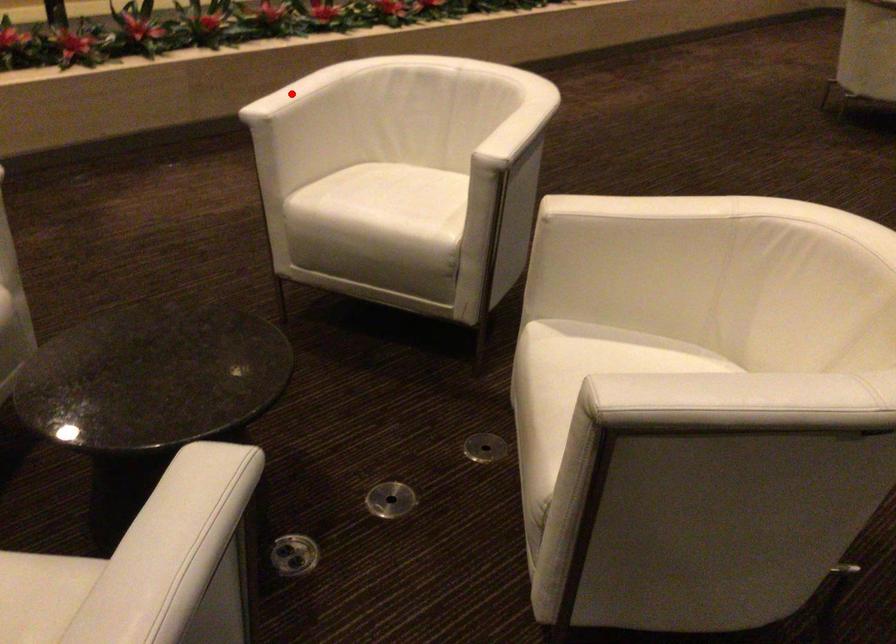
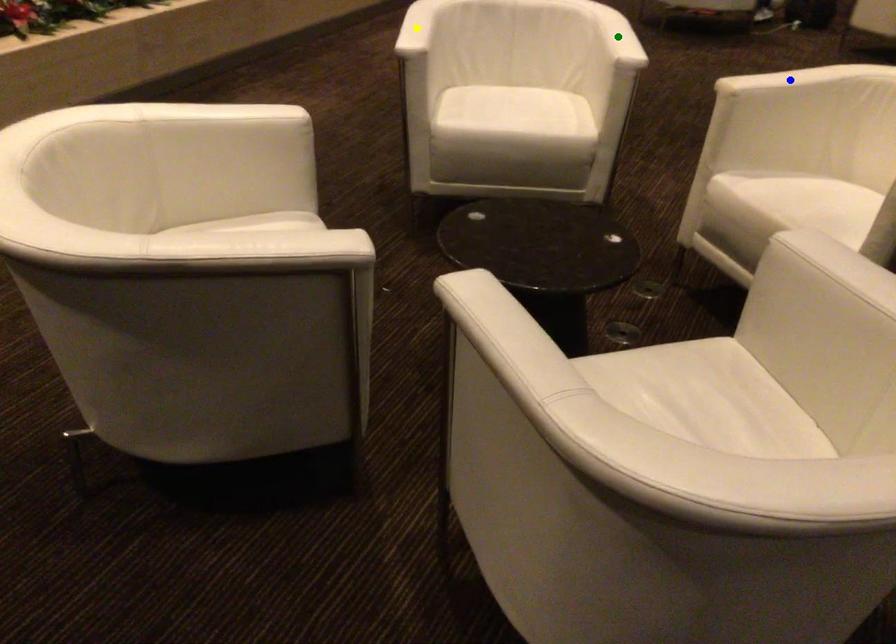
Question: I am providing you with two images of the same scene from different viewpoints. A red point is marked on the first image. You are given multiple points on the second image. Which mark in image 2 goes with the point in image 1?

Choices:
 (A) blue point
 (B) yellow point
 (C) green point

Answer: (B)